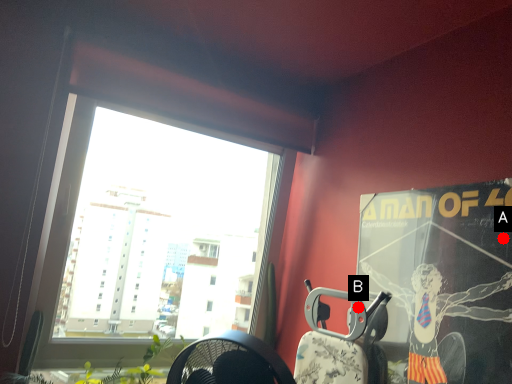
Question: Two points are circled on the image, labeled by A and B beside each circle. Which point is further to the camera?

Choices:
 (A) A is further
 (B) B is further

Answer: (B)